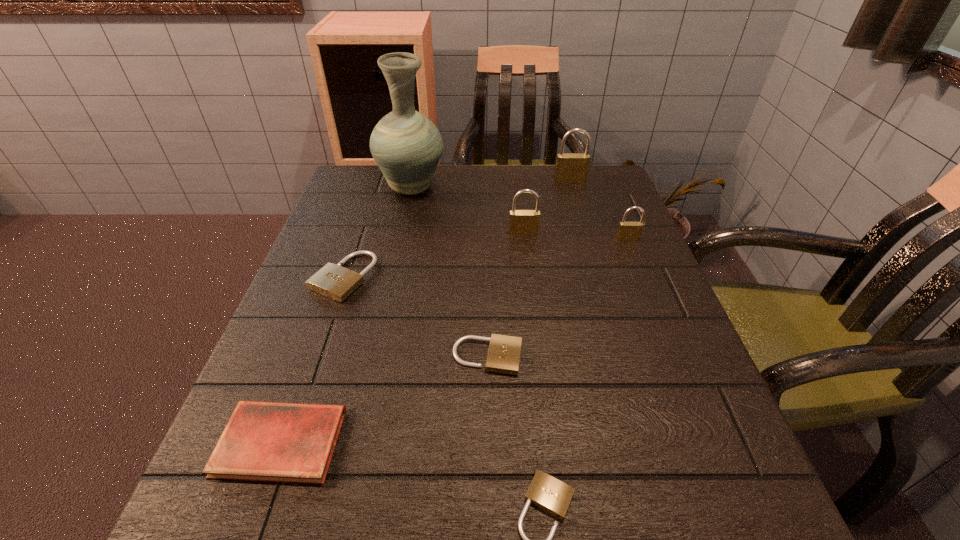
You are a GUI agent. You are given a task and a screenshot of the screen. Output one action in this format:
    pyautogui.click(x=<x>, y=<y>)
    Task: Click on the pitcher
    
    Given the screenshot: What is the action you would take?
    pyautogui.click(x=406, y=145)

Where is `the biggest brass padlock`? the biggest brass padlock is located at coordinates coord(570,167).

Locate an element on the screen. Image resolution: width=960 pixels, height=540 pixels. the second brass padlock from right to left is located at coordinates (570, 167).

Where is `the second farthest padlock`? The height and width of the screenshot is (540, 960). the second farthest padlock is located at coordinates (521, 222).

I want to click on the sixth nearest object, so click(521, 222).

The width and height of the screenshot is (960, 540). I want to click on the fourth nearest padlock, so click(x=627, y=231).

Find the location of a particular element. The height and width of the screenshot is (540, 960). the smallest brass padlock is located at coordinates (627, 231).

You are a GUI agent. You are given a task and a screenshot of the screen. Output one action in this format:
    pyautogui.click(x=<x>, y=<y>)
    Task: Click on the biggest beige padlock
    Image resolution: width=960 pixels, height=540 pixels.
    Given the screenshot: What is the action you would take?
    pyautogui.click(x=336, y=282)

I want to click on the leftmost padlock, so click(x=336, y=282).

Identify the location of the second nearest beige padlock. (504, 351).